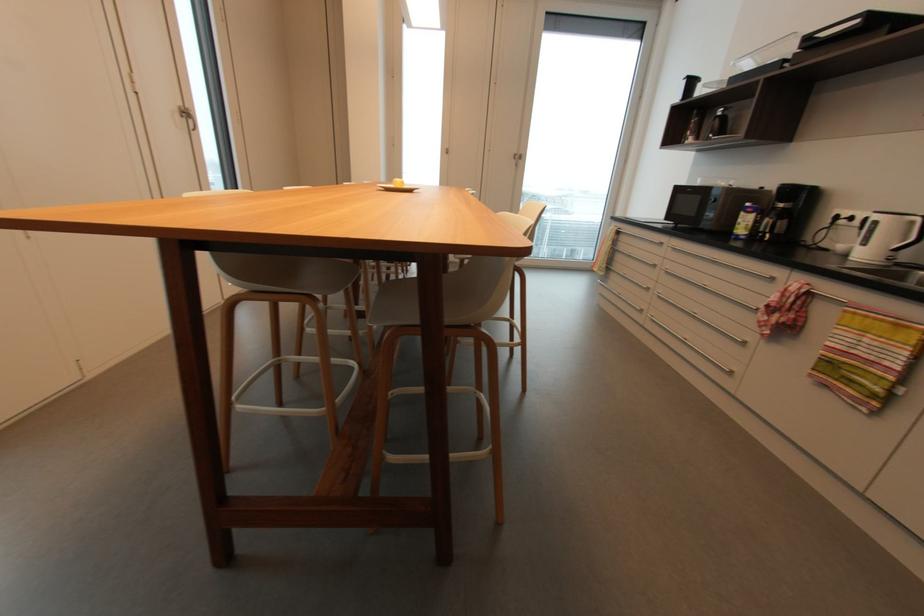
Locate an element on the screen. white kettle handle is located at coordinates (912, 233).